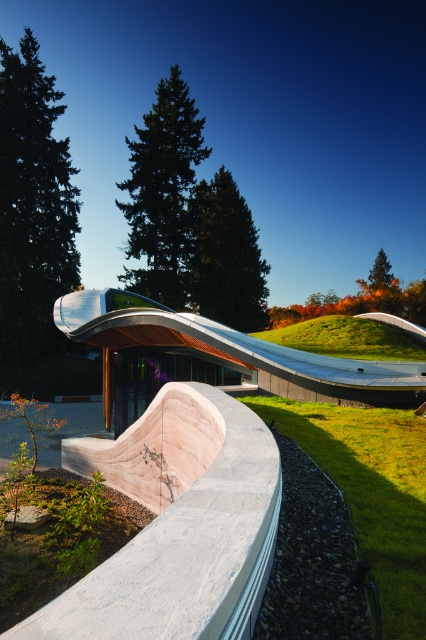
Question: Which object appears closest to the camera in this image?

Choices:
 (A) white polished concrete bench at center
 (B) white concrete skate park at center
 (C) green grass at lower right

Answer: (A)

Question: Is white polished concrete bench at center positioned behind green grass at upper center?

Choices:
 (A) yes
 (B) no

Answer: (B)

Question: Which of the following is the farthest from the observer?

Choices:
 (A) silver metallic slide at center
 (B) white concrete skate park at center

Answer: (A)

Question: Can you confirm if white polished concrete bench at center is smaller than green grass at upper center?

Choices:
 (A) yes
 (B) no

Answer: (B)

Question: Does green grass at lower right lie behind silver metallic slide at center?

Choices:
 (A) yes
 (B) no

Answer: (B)

Question: Which object is closer to the camera taking this photo?

Choices:
 (A) white concrete skate park at center
 (B) green grass at lower right
 (C) green grass at upper center
 (D) white polished concrete bench at center

Answer: (D)